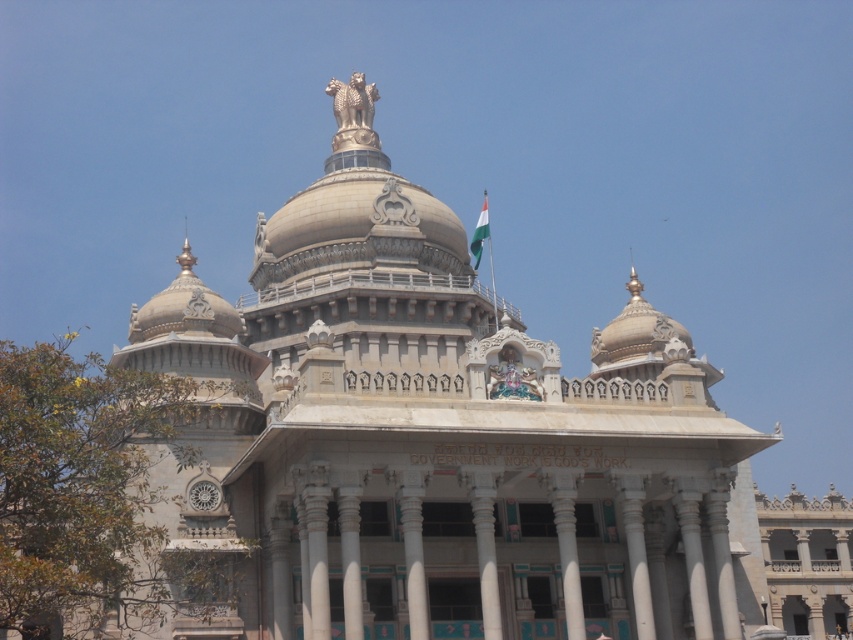
Question: Which point is closer to the camera taking this photo?

Choices:
 (A) (527, 365)
 (B) (480, 221)

Answer: (A)

Question: Does polychrome stone statue at center have a greater width compared to green fabric flag at upper center?

Choices:
 (A) yes
 (B) no

Answer: (B)

Question: Does polychrome stone statue at center have a lesser width compared to green fabric flag at upper center?

Choices:
 (A) yes
 (B) no

Answer: (A)

Question: Is polychrome stone statue at center positioned before green fabric flag at upper center?

Choices:
 (A) no
 (B) yes

Answer: (B)